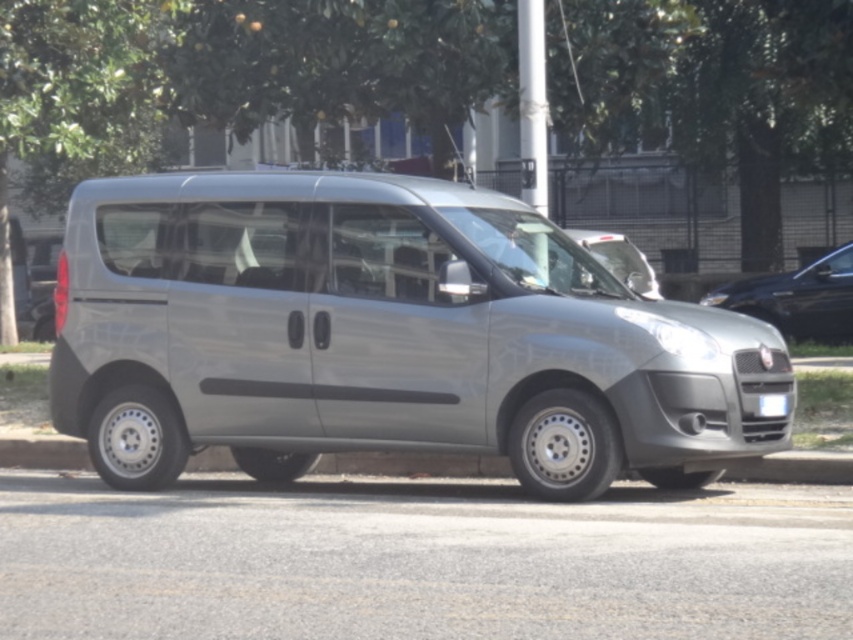
Between green leafy tree at upper center and silver metallic van at center, which one appears on the left side from the viewer's perspective?

From the viewer's perspective, green leafy tree at upper center appears more on the left side.

From the picture: Which of these two, green leafy tree at upper center or silver metallic van at center, stands taller?

green leafy tree at upper center is taller.

Between point (720, 97) and point (817, 257), which one is positioned behind?

Point (817, 257)

At what (x,y) coordinates should I click in order to perform the action: click on green leafy tree at upper center. Please return your answer as a coordinate pair (x, y). The width and height of the screenshot is (853, 640). Looking at the image, I should click on (230, 76).

How distant is silver metallic van at center from white plastic license plate at center?

silver metallic van at center and white plastic license plate at center are 40.47 feet apart.

From the picture: Between silver metallic van at center and white plastic license plate at center, which one appears on the left side from the viewer's perspective?

white plastic license plate at center

Does point (828, 324) come closer to viewer compared to point (776, 401)?

No, (828, 324) is further to viewer.

Image resolution: width=853 pixels, height=640 pixels. I want to click on silver metallic van at center, so click(x=798, y=298).

Is green leafy tree at upper center to the right of white plastic license plate at center from the viewer's perspective?

In fact, green leafy tree at upper center is to the left of white plastic license plate at center.

Can you confirm if green leafy tree at upper center is smaller than white plastic license plate at center?

No.

Where is `green leafy tree at upper center`? This screenshot has width=853, height=640. green leafy tree at upper center is located at coordinates (230, 76).

The height and width of the screenshot is (640, 853). I want to click on green leafy tree at upper center, so click(x=230, y=76).